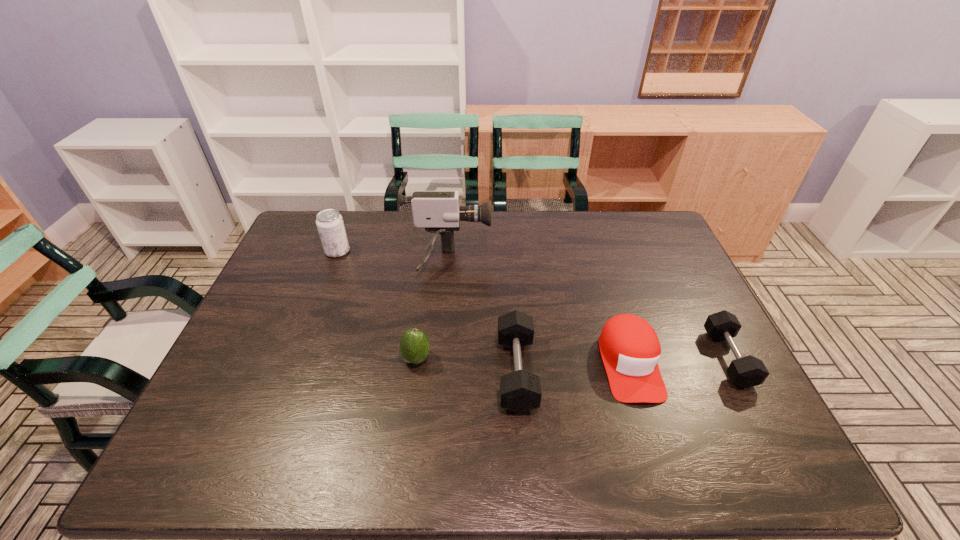
Locate an element on the screen. object that is at the far left corner is located at coordinates (330, 224).

The width and height of the screenshot is (960, 540). Identify the location of vacant space at the far edge of the desktop. (407, 217).

This screenshot has height=540, width=960. In the image, there is a desktop. What are the coordinates of `vacant space at the near edge` in the screenshot? It's located at (590, 417).

Locate an element on the screen. Image resolution: width=960 pixels, height=540 pixels. vacant space at the left edge is located at coordinates (311, 265).

Find the location of `free space at the right edge of the desktop`. free space at the right edge of the desktop is located at coordinates (679, 269).

Find the location of a particular element. The height and width of the screenshot is (540, 960). free space at the far left corner of the desktop is located at coordinates (286, 248).

In the image, there is a desktop. Where is `free space at the near left corner`? The width and height of the screenshot is (960, 540). free space at the near left corner is located at coordinates (236, 410).

The height and width of the screenshot is (540, 960). What are the coordinates of `free space at the far right corner of the desktop` in the screenshot? It's located at (654, 222).

Locate an element on the screen. free spot at the near right corner of the desktop is located at coordinates (699, 397).

Where is `vacant space that's between the fifth shortest object and the baseball cap`? Image resolution: width=960 pixels, height=540 pixels. vacant space that's between the fifth shortest object and the baseball cap is located at coordinates (483, 307).